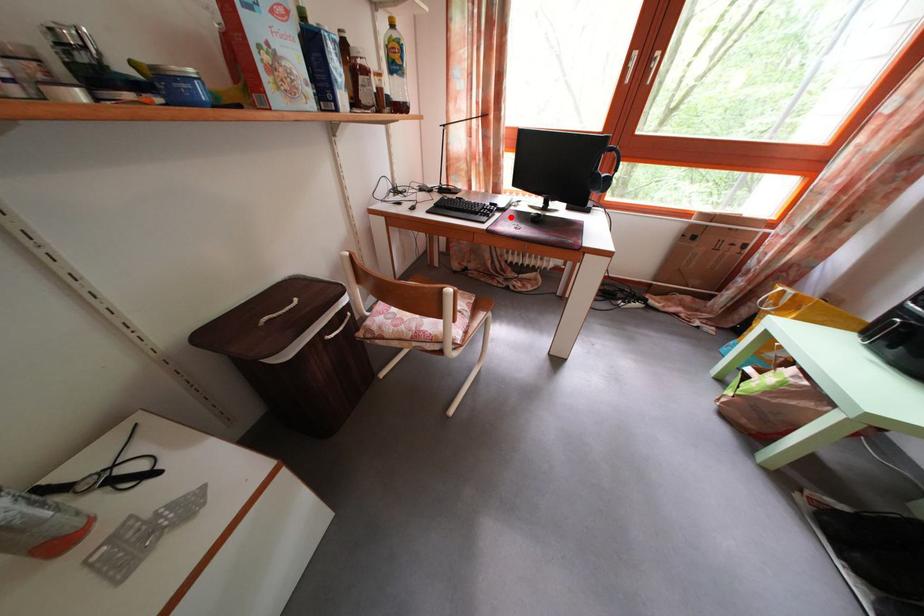
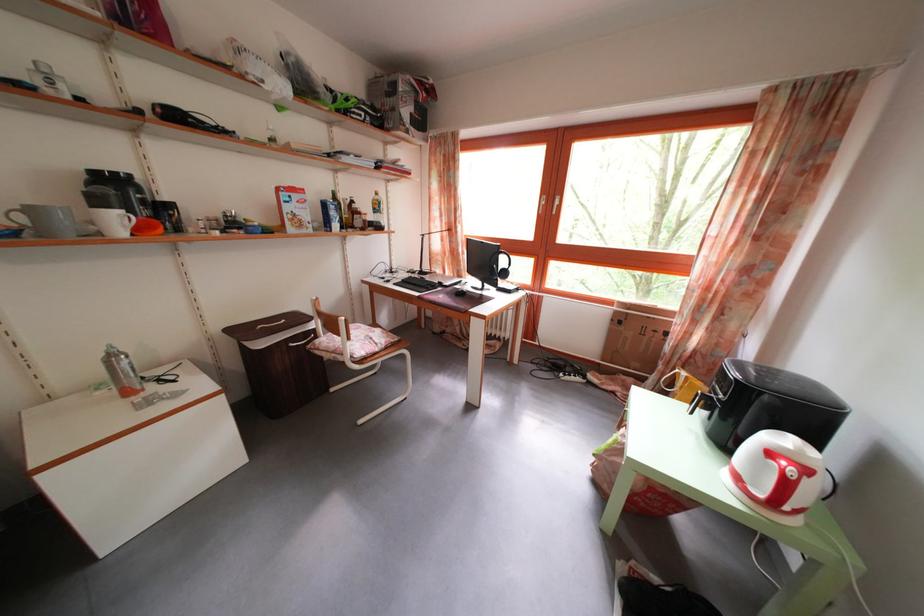
Locate, in the second image, the point that corresponds to the highlighted location in the first image.

(454, 294)